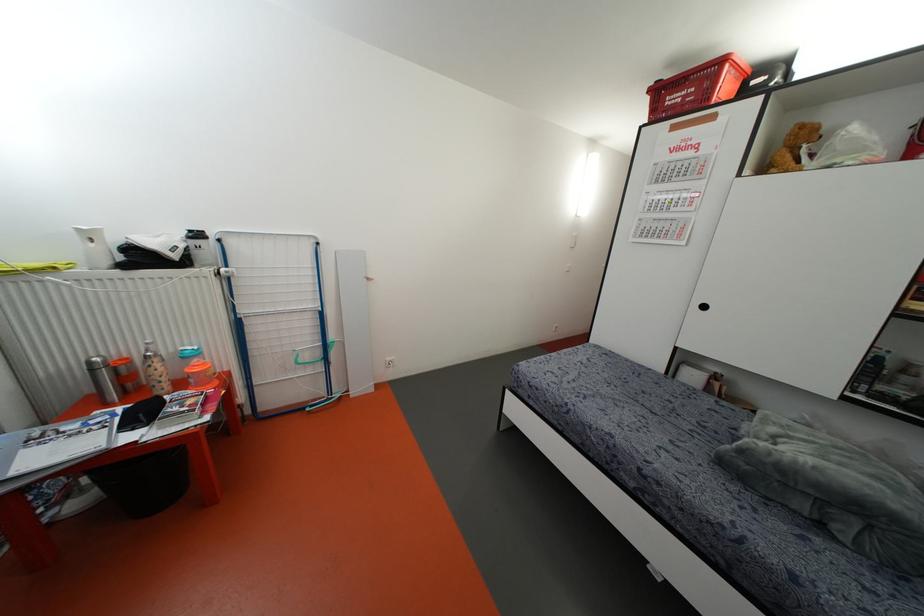
Find where to push the light switch. Please return your answer as a coordinate pair (x, y).

(388, 362)